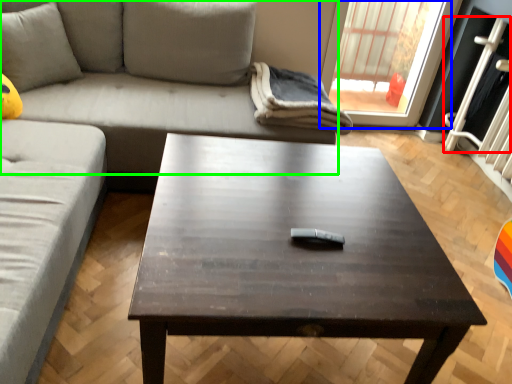
Question: Considering the real-world distances, which object is farthest from screen door (highlighted by a red box)? window (highlighted by a blue box) or studio couch (highlighted by a green box)?

Choices:
 (A) window
 (B) studio couch

Answer: (B)